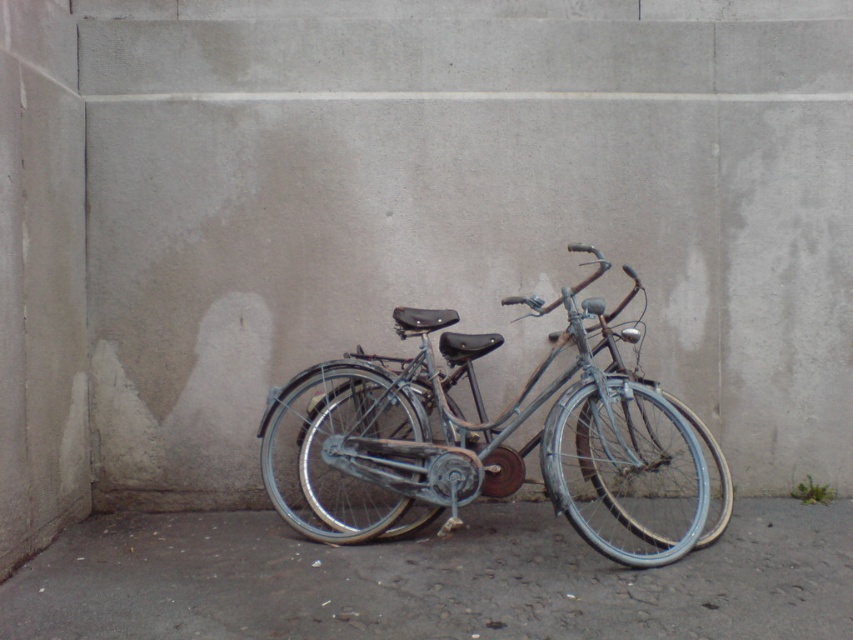
You are standing in front of two bicycles parked against a wall. You notice two points marked on the wall at coordinates point (167,529) and point (299,384). Which point is closer to the wall?

Point (167,529) is behind point (299,384), so point (167,529) is closer to the wall.

You are a painter standing on the ground. You need to paint the gray concrete at lower center and the blue metallic bicycle at center. Which object will require you to bend down more to paint?

The gray concrete at lower center is shorter than the blue metallic bicycle at center, so you will need to bend down more to paint the gray concrete at lower center.

You are standing in front of the two bicycles. Which object takes up more space in the image, the gray concrete at lower center or the blue metallic bicycle at center?

The blue metallic bicycle at center takes up more space in the image than the gray concrete at lower center because the gray concrete at lower center is smaller than the blue metallic bicycle at center.